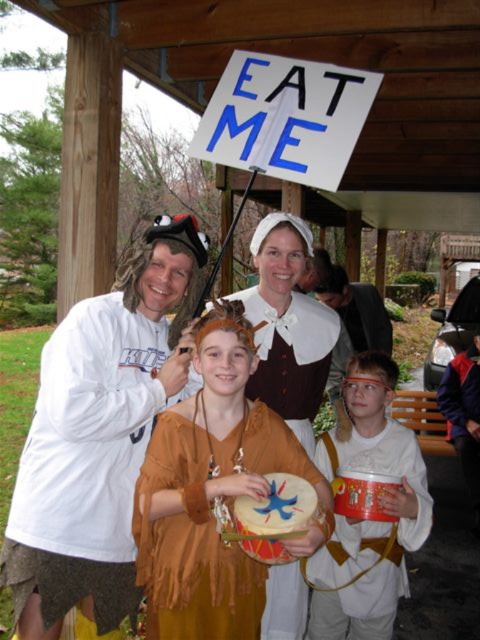
Question: Where is brown leather skirt at left located in relation to matte brown dress at center in the image?

Choices:
 (A) below
 (B) above

Answer: (A)

Question: Which is nearer to the white matte drum at center?

Choices:
 (A) matte brown dress at center
 (B) brown leather skirt at left
 (C) orange fabric drum at center

Answer: (A)

Question: Observing the image, what is the correct spatial positioning of brown leather skirt at left in reference to white matte drum at center?

Choices:
 (A) below
 (B) above

Answer: (B)

Question: Is brown suede drum at center to the left of orange fabric drum at center from the viewer's perspective?

Choices:
 (A) no
 (B) yes

Answer: (B)

Question: Estimate the real-world distances between objects in this image. Which object is closer to the white matte drum at center?

Choices:
 (A) matte brown dress at center
 (B) orange fabric drum at center

Answer: (A)

Question: Among these points, which one is nearest to the camera?

Choices:
 (A) (351, 634)
 (B) (303, 266)
 (C) (144, 525)

Answer: (C)